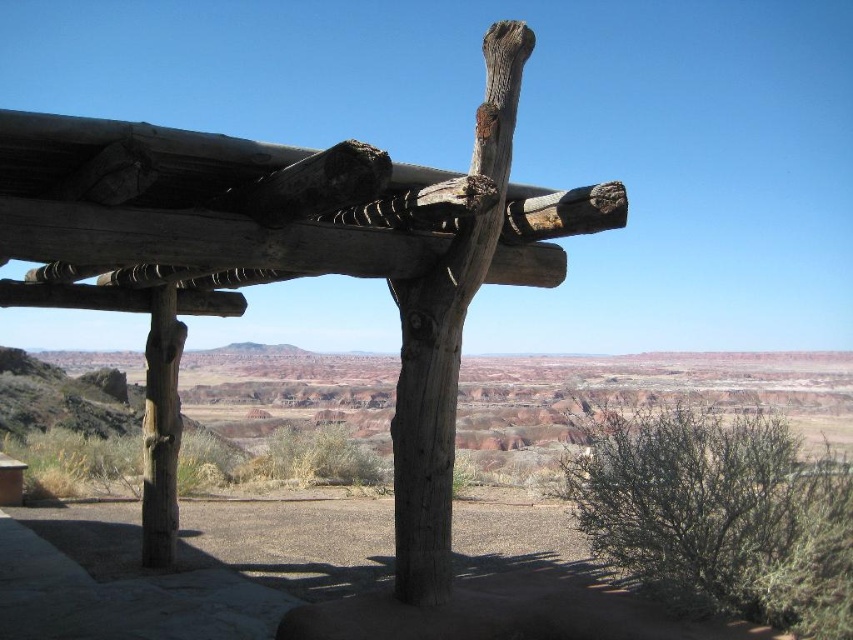
Is point (224, 272) closer to camera compared to point (421, 368)?

No.

The height and width of the screenshot is (640, 853). Describe the element at coordinates (289, 262) in the screenshot. I see `natural wood post at center` at that location.

Find the location of a particular element. This screenshot has height=640, width=853. natural wood post at center is located at coordinates (289, 262).

You are a GUI agent. You are given a task and a screenshot of the screen. Output one action in this format:
    pyautogui.click(x=<x>, y=<y>)
    Task: Click on the natural wood post at center
    The height and width of the screenshot is (640, 853).
    Given the screenshot: What is the action you would take?
    pyautogui.click(x=289, y=262)